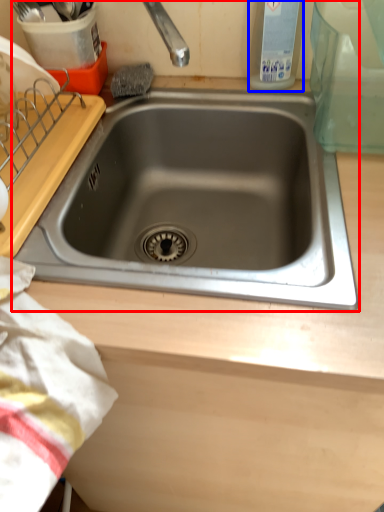
Question: Which object is further to the camera taking this photo, sink (highlighted by a red box) or bottle (highlighted by a blue box)?

Choices:
 (A) sink
 (B) bottle

Answer: (B)